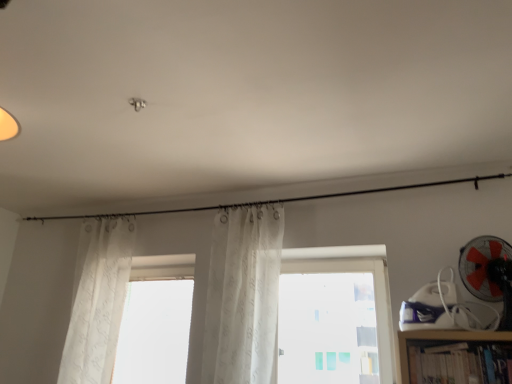
Question: Is white sheer curtain at center, the first curtain when ordered from right to left, not near transparent glass window at center?

Choices:
 (A) yes
 (B) no

Answer: (B)

Question: Does white sheer curtain at center, which is the 2th curtain from left to right, have a larger size compared to transparent glass window at center?

Choices:
 (A) no
 (B) yes

Answer: (A)

Question: From a real-world perspective, is white sheer curtain at center, which is the 2th curtain from left to right, over transparent glass window at center?

Choices:
 (A) no
 (B) yes

Answer: (B)

Question: Can you confirm if white sheer curtain at center, which is the 2th curtain from left to right, is thinner than transparent glass window at center?

Choices:
 (A) yes
 (B) no

Answer: (A)

Question: Is white sheer curtain at center, which is the 2th curtain from left to right, wider than transparent glass window at center?

Choices:
 (A) no
 (B) yes

Answer: (A)

Question: From a real-world perspective, is red plastic fan at right physically located above or below translucent white curtain at left, which is counted as the first curtain, starting from the left?

Choices:
 (A) below
 (B) above

Answer: (B)

Question: Relative to translucent white curtain at left, which is counted as the first curtain, starting from the left, is red plastic fan at right in front or behind?

Choices:
 (A) front
 (B) behind

Answer: (A)

Question: Based on their positions, is red plastic fan at right located to the left or right of translucent white curtain at left, which is counted as the first curtain, starting from the left?

Choices:
 (A) left
 (B) right

Answer: (B)

Question: Is red plastic fan at right inside the boundaries of translucent white curtain at left, positioned as the second curtain in right-to-left order, or outside?

Choices:
 (A) outside
 (B) inside

Answer: (A)

Question: Is red plastic fan at right inside the boundaries of hardcover book at lower right, or outside?

Choices:
 (A) inside
 (B) outside

Answer: (B)

Question: From the image's perspective, is red plastic fan at right located above or below hardcover book at lower right?

Choices:
 (A) below
 (B) above

Answer: (B)

Question: Relative to hardcover book at lower right, is red plastic fan at right in front or behind?

Choices:
 (A) front
 (B) behind

Answer: (B)

Question: In terms of height, does red plastic fan at right look taller or shorter compared to hardcover book at lower right?

Choices:
 (A) tall
 (B) short

Answer: (A)

Question: From the image's perspective, is translucent white curtain at left, which is counted as the first curtain, starting from the left, above or below white sheer curtain at center, which is the 2th curtain from left to right?

Choices:
 (A) below
 (B) above

Answer: (A)

Question: Considering the positions of translucent white curtain at left, positioned as the second curtain in right-to-left order, and white sheer curtain at center, the first curtain when ordered from right to left, in the image, is translucent white curtain at left, positioned as the second curtain in right-to-left order, taller or shorter than white sheer curtain at center, the first curtain when ordered from right to left,?

Choices:
 (A) short
 (B) tall

Answer: (B)